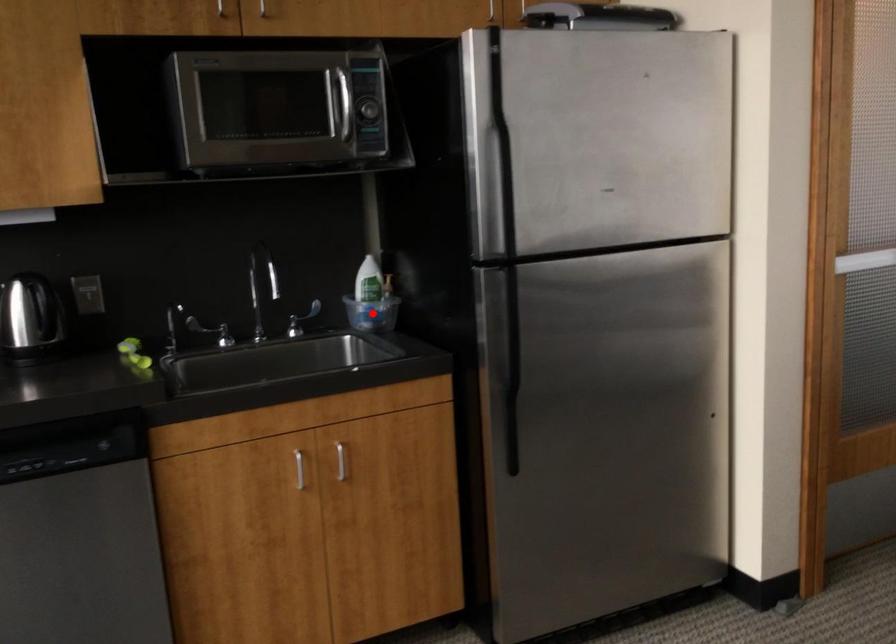
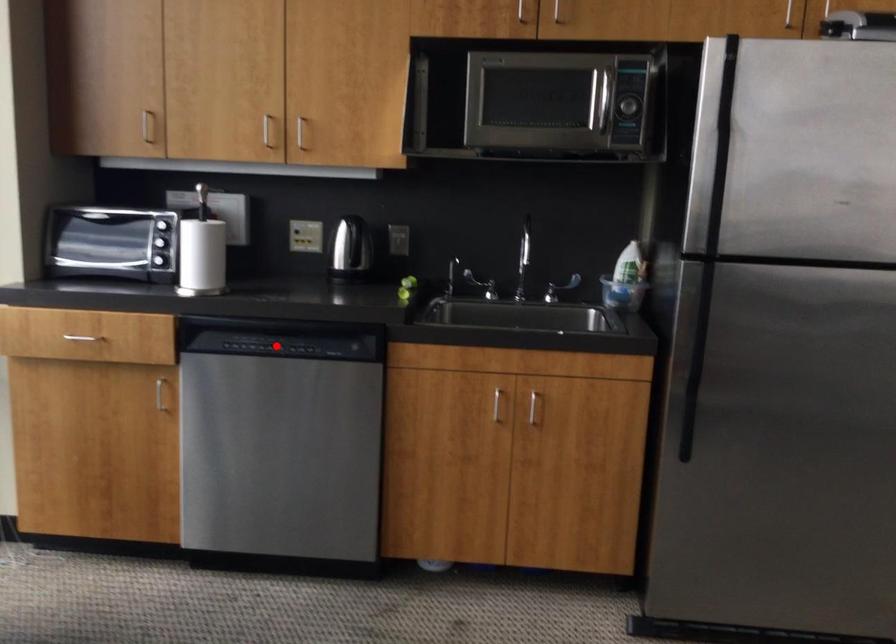
I am providing you with two images of the same scene from different viewpoints. A red point is marked on the first image and another point is marked on the second image. Does the point marked in image1 correspond to the same location as the one in image2?

No